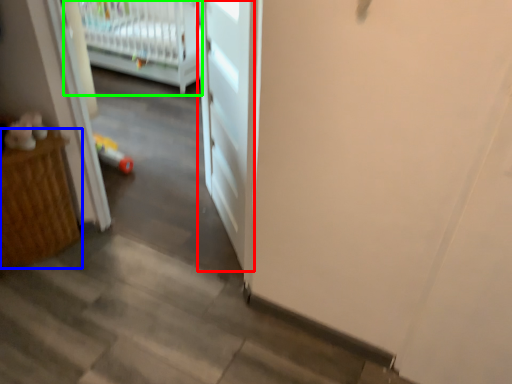
Question: Considering the real-world distances, which object is farthest from door (highlighted by a red box)? furniture (highlighted by a blue box) or infant bed (highlighted by a green box)?

Choices:
 (A) furniture
 (B) infant bed

Answer: (B)